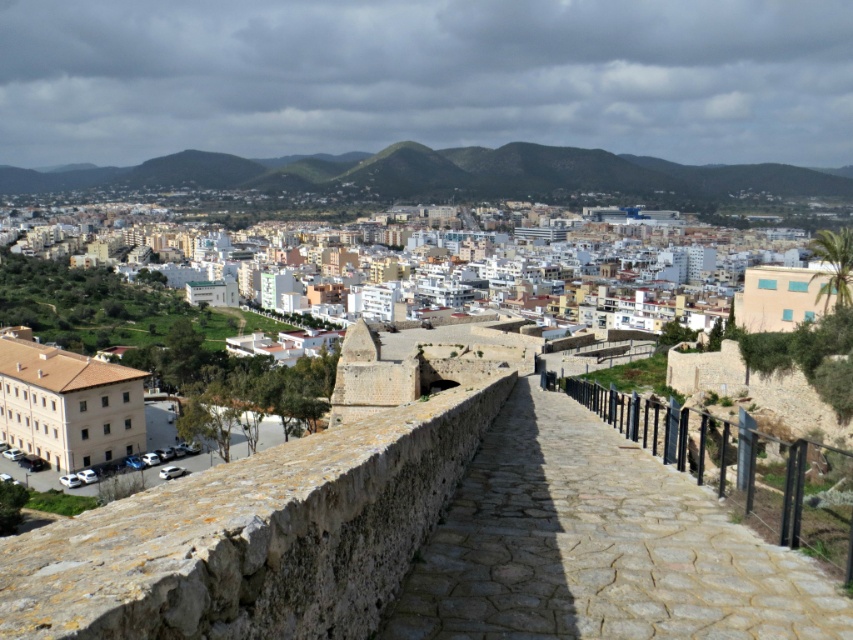
Question: Which point is farther to the camera?

Choices:
 (A) (497, 173)
 (B) (68, 465)
 (C) (474, 628)
 (D) (469, 376)

Answer: (A)

Question: Can you confirm if stone paved pathway at center is wider than stone wall at center?

Choices:
 (A) yes
 (B) no

Answer: (B)

Question: From the image, what is the correct spatial relationship of stone paved pathway at center in relation to green grassy hill at upper center?

Choices:
 (A) below
 (B) above

Answer: (A)

Question: Among these points, which one is nearest to the camera?

Choices:
 (A) (648, 182)
 (B) (123, 417)
 (C) (416, 380)
 (D) (419, 637)

Answer: (D)

Question: Does stone paved pathway at center have a lesser width compared to stone wall at center?

Choices:
 (A) no
 (B) yes

Answer: (B)

Question: Which of the following is the closest to the observer?

Choices:
 (A) brown stone building at lower left
 (B) green grassy hill at upper center
 (C) stone wall at center
 (D) stone paved pathway at center

Answer: (D)